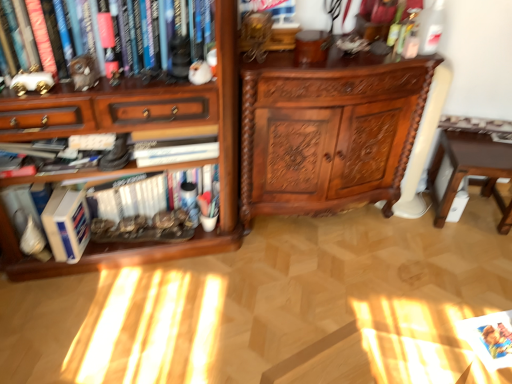
The height and width of the screenshot is (384, 512). In order to click on spots to the right of wooden bookcase at left in this screenshot , I will do `click(290, 293)`.